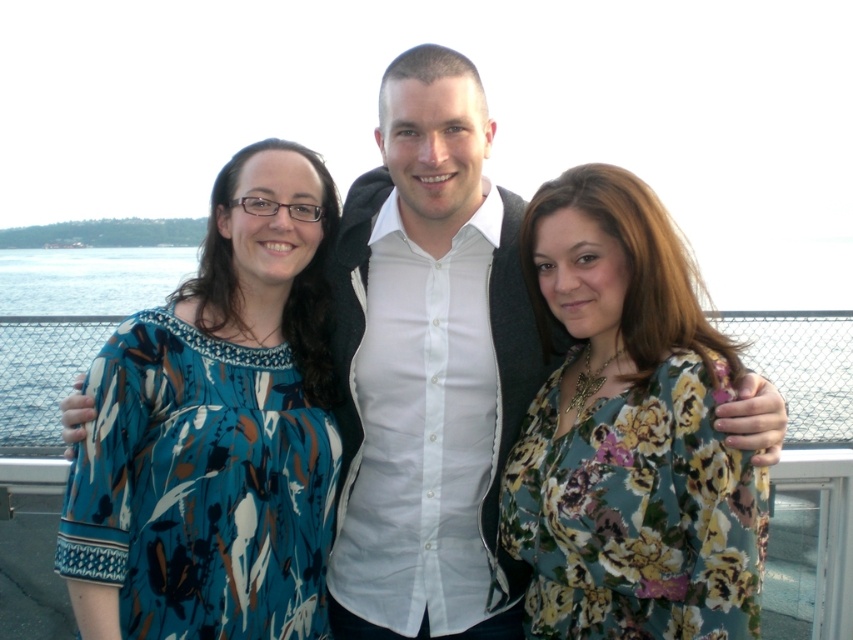
You are a photographer trying to capture a group photo of the blue floral blouse at left and the white matte shirt at center. Since you want everyone to be visible, which person should you position closer to the camera to ensure their full height is captured?

The blue floral blouse at left is not as tall as the white matte shirt at center, so you should position the blue floral blouse at left closer to the camera to ensure their full height is captured.

You are a photographer standing 2 meters away from the blue floral blouse at left and floral print blouse at center. You want to take a photo that includes both blouses in the frame. Given their distance apart, is it possible to capture both in a single shot without moving the camera?

The blue floral blouse at left is 1.47 meters away from the floral print blouse at center. Since you are 2 meters away from both, the distance between them is less than your distance from them, so it should be possible to capture both in a single shot without moving the camera.

You are a photographer setting up a shot of the three people on the pier. You need to ensure that both the blue floral blouse at left and the floral print blouse at center are clearly visible. Given their sizes, which blouse might you need to adjust your camera angle to better highlight?

The blue floral blouse at left is larger in size than the floral print blouse at center, so you might need to adjust the camera angle to ensure the smaller floral print blouse at center is adequately highlighted alongside the larger one.